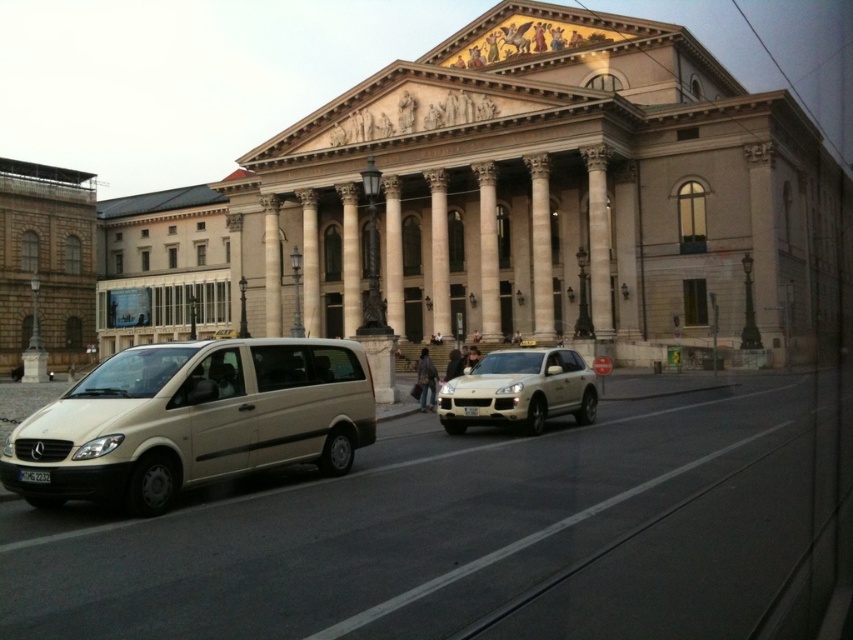
You are a delivery person who needs to park your beige matte van at lower left and metallic gold suv at center in a parking lot with limited space. Which vehicle should you park first to maximize space efficiency?

The beige matte van at lower left is larger than the metallic gold suv at center. To maximize space efficiency, you should park the metallic gold suv at center first, leaving the larger space for the beige matte van at lower left.